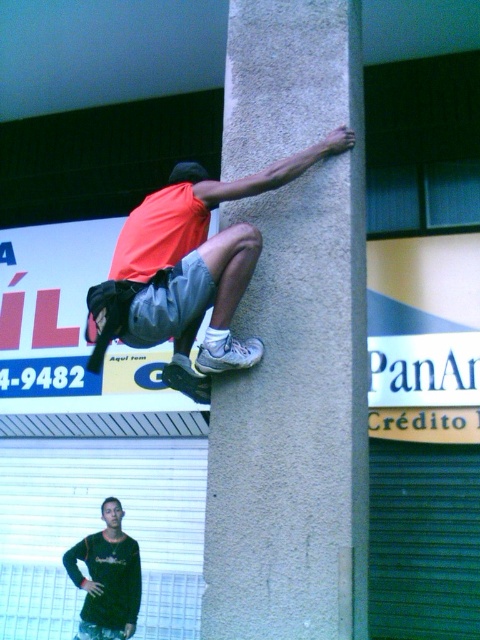
You are standing at the base of the gray concrete pillar at center and want to place a sticker on the orange fabric skateboard at upper center. Which direction should you look to find the skateboard?

The orange fabric skateboard at upper center is to the left of the gray concrete pillar at center, so you should look to the left to find it.

You are a photographer positioned at the scene. You want to capture a photo that includes both the gray concrete pillar at center and the black matte shirt at lower left. Based on their positions, which object should be placed on the right side of the photo frame?

The gray concrete pillar at center should be placed on the right side of the photo frame because it is located to the right of the black matte shirt at lower left.